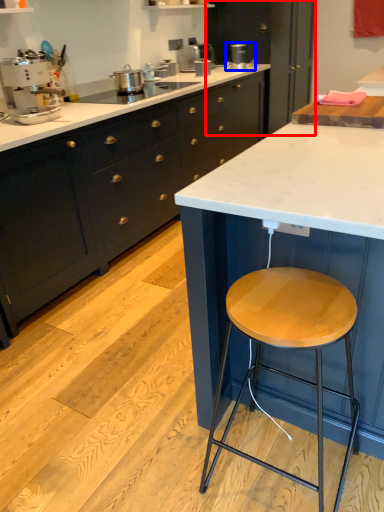
Question: Which object is closer to the camera taking this photo, cabinetry (highlighted by a red box) or appliance (highlighted by a blue box)?

Choices:
 (A) cabinetry
 (B) appliance

Answer: (B)